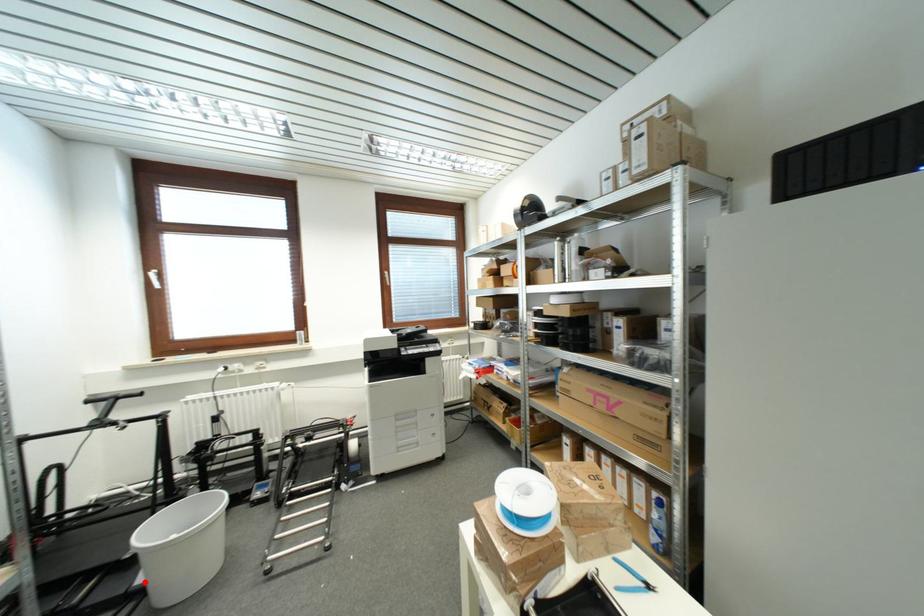
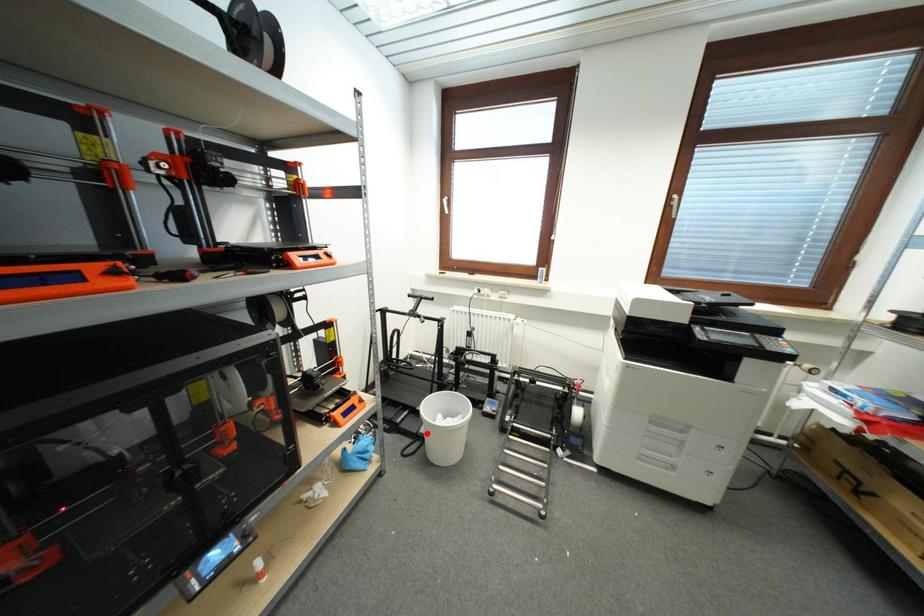
I am providing you with two images of the same scene from different viewpoints. A red point is marked on the first image and another point is marked on the second image. Are the points marked in image1 and image2 representing the same 3D position?

Yes